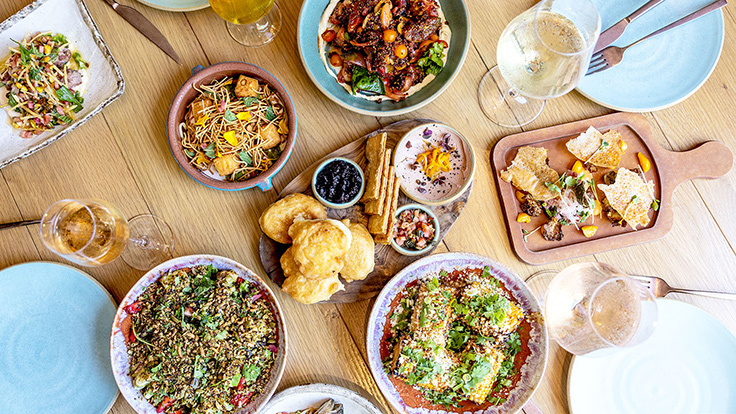
Find the location of a particular element. The height and width of the screenshot is (414, 736). empty plate is located at coordinates (665, 368), (644, 75), (67, 299), (177, 3).